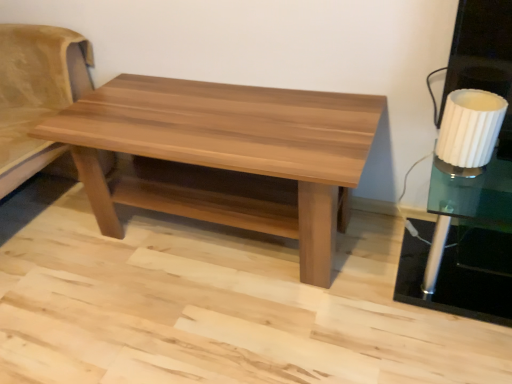
Question: Is white ribbed glass at right smaller than suede beige futon at left?

Choices:
 (A) yes
 (B) no

Answer: (A)

Question: Is white ribbed glass at right to the left of suede beige futon at left from the viewer's perspective?

Choices:
 (A) no
 (B) yes

Answer: (A)

Question: Is white ribbed glass at right outside suede beige futon at left?

Choices:
 (A) no
 (B) yes

Answer: (B)

Question: Could suede beige futon at left be considered to be inside white ribbed glass at right?

Choices:
 (A) yes
 (B) no

Answer: (B)

Question: Is the depth of white ribbed glass at right greater than that of suede beige futon at left?

Choices:
 (A) no
 (B) yes

Answer: (A)

Question: From a real-world perspective, is light brown wood coffee table at center physically located above or below suede beige futon at left?

Choices:
 (A) below
 (B) above

Answer: (A)

Question: Looking at the image, does light brown wood coffee table at center seem bigger or smaller compared to suede beige futon at left?

Choices:
 (A) small
 (B) big

Answer: (A)

Question: Is point (345, 150) closer or farther from the camera than point (26, 178)?

Choices:
 (A) farther
 (B) closer

Answer: (B)

Question: Considering the positions of light brown wood coffee table at center and suede beige futon at left in the image, is light brown wood coffee table at center taller or shorter than suede beige futon at left?

Choices:
 (A) short
 (B) tall

Answer: (A)

Question: Considering the positions of white ribbed glass at right and white ribbed glass side table at right in the image, is white ribbed glass at right wider or thinner than white ribbed glass side table at right?

Choices:
 (A) thin
 (B) wide

Answer: (A)

Question: Is point (479, 130) closer or farther from the camera than point (442, 241)?

Choices:
 (A) closer
 (B) farther

Answer: (A)

Question: Considering the positions of white ribbed glass at right and white ribbed glass side table at right in the image, is white ribbed glass at right bigger or smaller than white ribbed glass side table at right?

Choices:
 (A) small
 (B) big

Answer: (A)

Question: Do you think white ribbed glass at right is within white ribbed glass side table at right, or outside of it?

Choices:
 (A) outside
 (B) inside

Answer: (A)

Question: Is suede beige futon at left in front of or behind light brown wood coffee table at center in the image?

Choices:
 (A) front
 (B) behind

Answer: (B)

Question: Is suede beige futon at left wider or thinner than light brown wood coffee table at center?

Choices:
 (A) thin
 (B) wide

Answer: (B)